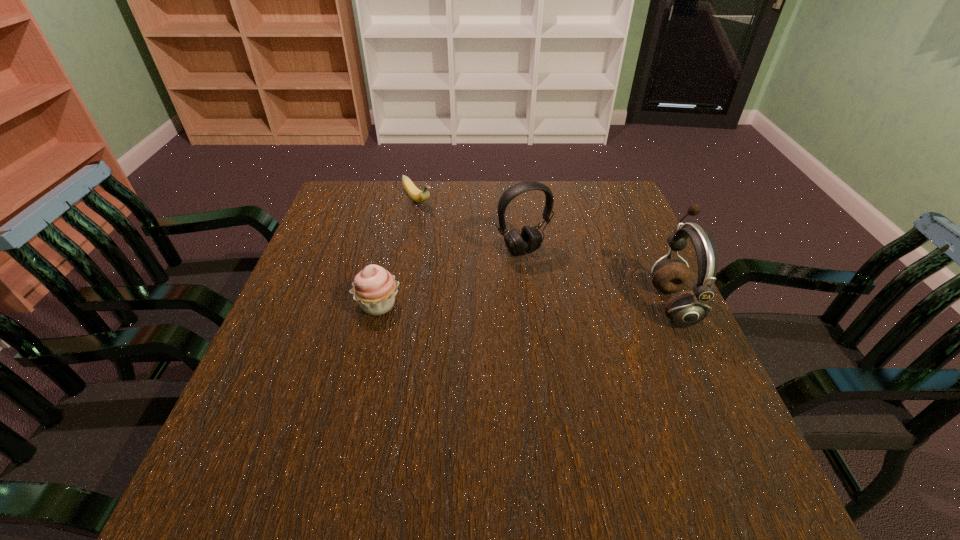
Find the location of `free area in between the rightmost object and the shortest object`. free area in between the rightmost object and the shortest object is located at coordinates (545, 252).

Image resolution: width=960 pixels, height=540 pixels. I want to click on vacant space that's between the banana and the rightmost object, so click(545, 252).

You are a GUI agent. You are given a task and a screenshot of the screen. Output one action in this format:
    pyautogui.click(x=<x>, y=<y>)
    Task: Click on the free space between the earphone and the second tallest object
    
    Given the screenshot: What is the action you would take?
    pyautogui.click(x=597, y=277)

Where is `free space between the headset and the third tallest object`? free space between the headset and the third tallest object is located at coordinates (450, 278).

Identify which object is the nearest to the rightmost object. Please provide its 2D coordinates. Your answer should be formatted as a tuple, i.e. [(x, y)], where the tuple contains the x and y coordinates of a point satisfying the conditions above.

[(530, 240)]

Point out which object is positioned as the nearest to the farthest object. Please provide its 2D coordinates. Your answer should be formatted as a tuple, i.e. [(x, y)], where the tuple contains the x and y coordinates of a point satisfying the conditions above.

[(530, 240)]

The width and height of the screenshot is (960, 540). In order to click on vacant space that satisfies the following two spatial constraints: 1. on the back side of the rightmost object; 2. on the ear pads of the cupcake in this screenshot , I will do `click(378, 304)`.

Find the location of a particular element. This screenshot has height=540, width=960. vacant region that satisfies the following two spatial constraints: 1. on the front side of the banana; 2. on the ear pads of the earphone is located at coordinates (397, 304).

Where is `blank area in the image that satisfies the following two spatial constraints: 1. on the back side of the third tallest object; 2. on the left side of the banana`? The image size is (960, 540). blank area in the image that satisfies the following two spatial constraints: 1. on the back side of the third tallest object; 2. on the left side of the banana is located at coordinates coord(403,200).

Where is `free region that satisfies the following two spatial constraints: 1. on the front side of the earphone; 2. on the ear pads of the banana`? The image size is (960, 540). free region that satisfies the following two spatial constraints: 1. on the front side of the earphone; 2. on the ear pads of the banana is located at coordinates (397, 304).